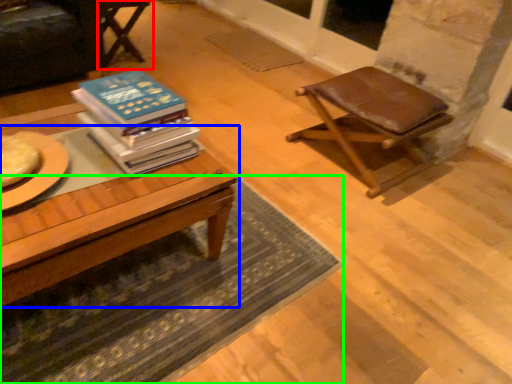
Question: Estimate the real-world distances between objects in this image. Which object is farther from chair (highlighted by a red box), table (highlighted by a blue box) or mat (highlighted by a green box)?

Choices:
 (A) table
 (B) mat

Answer: (B)